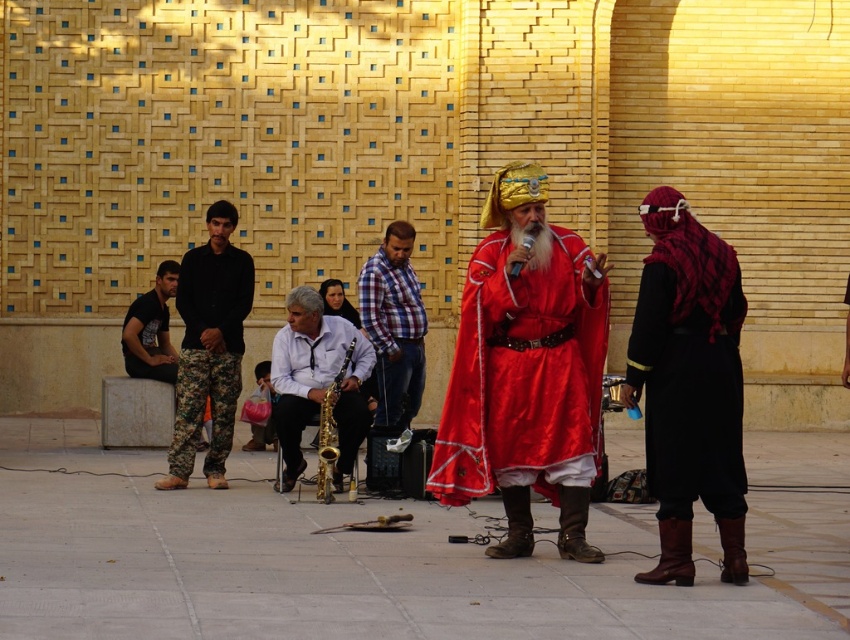
Does plaid fabric shirt at center lie in front of gold metallic saxophone at center?

No, it is not.

Can you confirm if plaid fabric shirt at center is taller than gold metallic saxophone at center?

Correct, plaid fabric shirt at center is much taller as gold metallic saxophone at center.

The width and height of the screenshot is (850, 640). I want to click on plaid fabric shirt at center, so click(394, 324).

Is black woolen robe at right below camouflage pants at left?

Actually, black woolen robe at right is above camouflage pants at left.

Can you confirm if black woolen robe at right is bigger than camouflage pants at left?

Incorrect, black woolen robe at right is not larger than camouflage pants at left.

The image size is (850, 640). What do you see at coordinates (688, 362) in the screenshot?
I see `black woolen robe at right` at bounding box center [688, 362].

Image resolution: width=850 pixels, height=640 pixels. Identify the location of black woolen robe at right. (688, 362).

Is gold shiny saxophone at center shorter than plaid fabric shirt at center?

Correct, gold shiny saxophone at center is not as tall as plaid fabric shirt at center.

Image resolution: width=850 pixels, height=640 pixels. I want to click on gold shiny saxophone at center, so click(x=316, y=381).

I want to click on gold shiny saxophone at center, so click(316, 381).